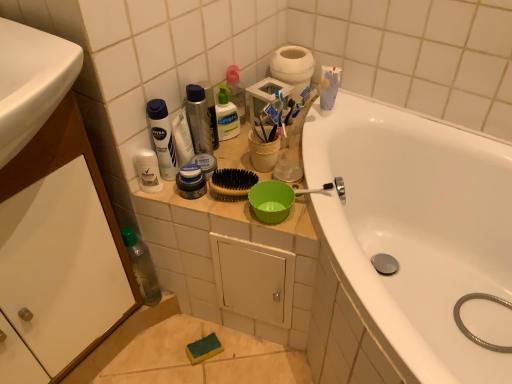
Locate an element on the screen. The width and height of the screenshot is (512, 384). vacant space to the right of metallic silver can at upper center, which appears as the second personal care when ordered from the bottom is located at coordinates (248, 147).